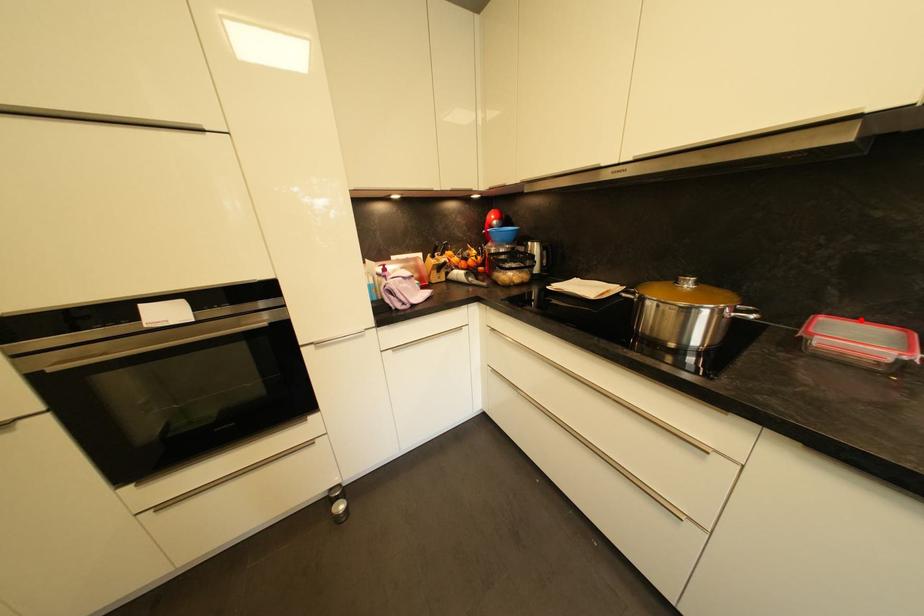
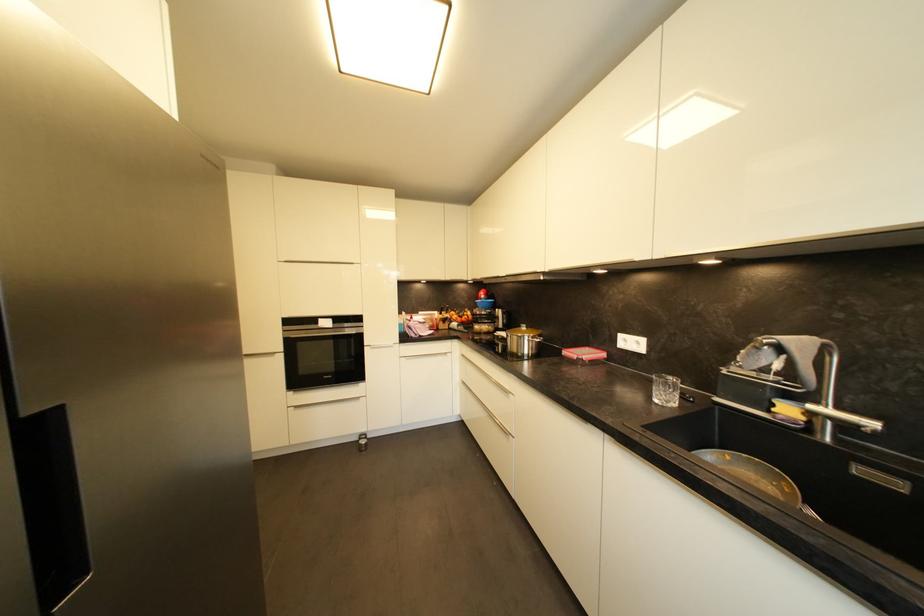
Locate, in the second image, the point that corresponds to the highlighted location in the first image.

(602, 350)